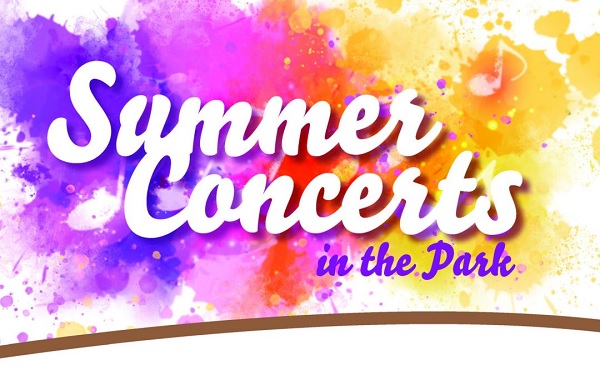
Where is `painted areas of yellow`? The image size is (600, 375). painted areas of yellow is located at coordinates (410, 46), (545, 22), (595, 140), (533, 237).